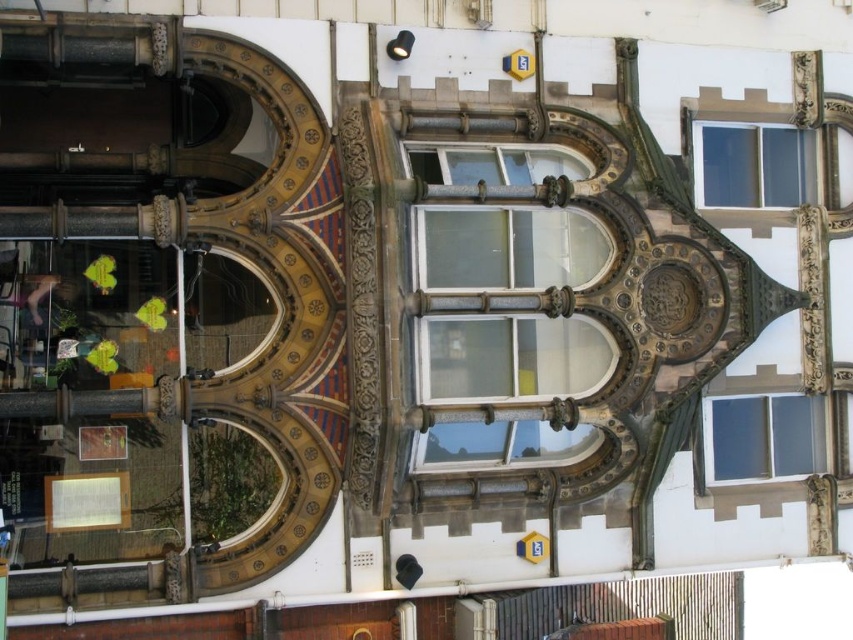
Question: Among these points, which one is nearest to the camera?

Choices:
 (A) (775, 404)
 (B) (764, 188)
 (C) (463, 420)

Answer: (C)

Question: Estimate the real-world distances between objects in this image. Which object is farther from the clear glass window at upper right?

Choices:
 (A) clear glass window at center
 (B) clear glass window at upper center

Answer: (A)

Question: Can you confirm if clear glass window at upper center is smaller than clear glass window at upper right?

Choices:
 (A) yes
 (B) no

Answer: (A)

Question: Which point is closer to the camera taking this photo?

Choices:
 (A) (749, 419)
 (B) (564, 349)
 (C) (805, 195)

Answer: (B)

Question: Is clear glass window at upper center to the right of clear glass window at upper right from the viewer's perspective?

Choices:
 (A) no
 (B) yes

Answer: (B)

Question: Is the position of clear glass window at center more distant than that of clear glass window at upper right?

Choices:
 (A) no
 (B) yes

Answer: (A)